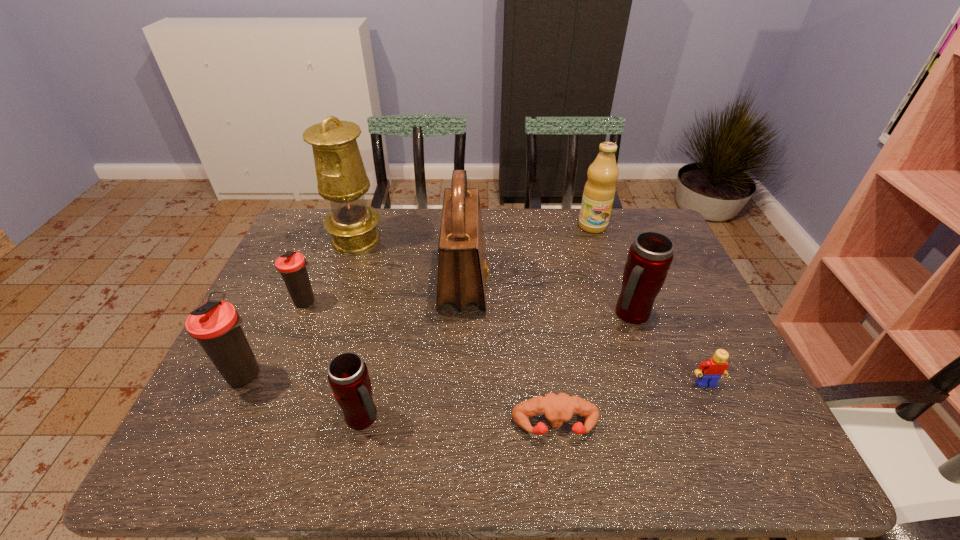
Identify the location of object that is at the far left corner. (341, 176).

Image resolution: width=960 pixels, height=540 pixels. In the image, there is a desktop. Identify the location of vacant space at the far edge. (605, 237).

Where is `vacant space at the near edge of the desktop`? vacant space at the near edge of the desktop is located at coordinates [x=329, y=470].

Locate an element on the screen. blank space at the left edge of the desktop is located at coordinates (265, 328).

Find the location of a particular element. The width and height of the screenshot is (960, 540). vacant area at the right edge is located at coordinates (697, 310).

Image resolution: width=960 pixels, height=540 pixels. Find the location of `free space at the far right corner of the desktop`. free space at the far right corner of the desktop is located at coordinates (667, 233).

I want to click on vacant area at the near right corner, so click(741, 458).

You are a GUI agent. You are given a task and a screenshot of the screen. Output one action in this format:
    pyautogui.click(x=<x>, y=<y>)
    Task: Click on the empty location between the shortest object and the oil lamp
    The image size is (960, 540).
    Given the screenshot: What is the action you would take?
    pyautogui.click(x=456, y=332)

This screenshot has width=960, height=540. What are the coordinates of `free space between the rightmost thermos bottle and the second nearest thermos bottle` in the screenshot? It's located at (439, 343).

This screenshot has height=540, width=960. Find the location of `free space between the shortest object and the rightmost thermos bottle`. free space between the shortest object and the rightmost thermos bottle is located at coordinates click(x=593, y=370).